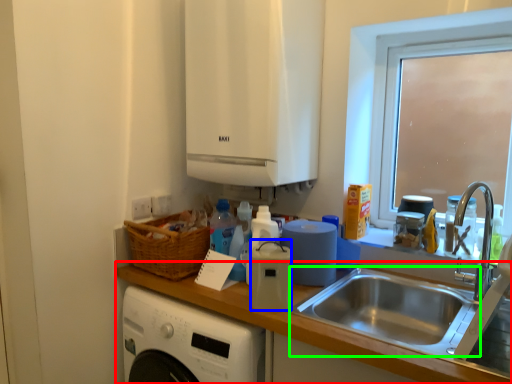
Question: Estimate the real-world distances between objects in this image. Which object is farther from countertop (highlighted by a red box), appliance (highlighted by a blue box) or sink (highlighted by a green box)?

Choices:
 (A) appliance
 (B) sink

Answer: (B)